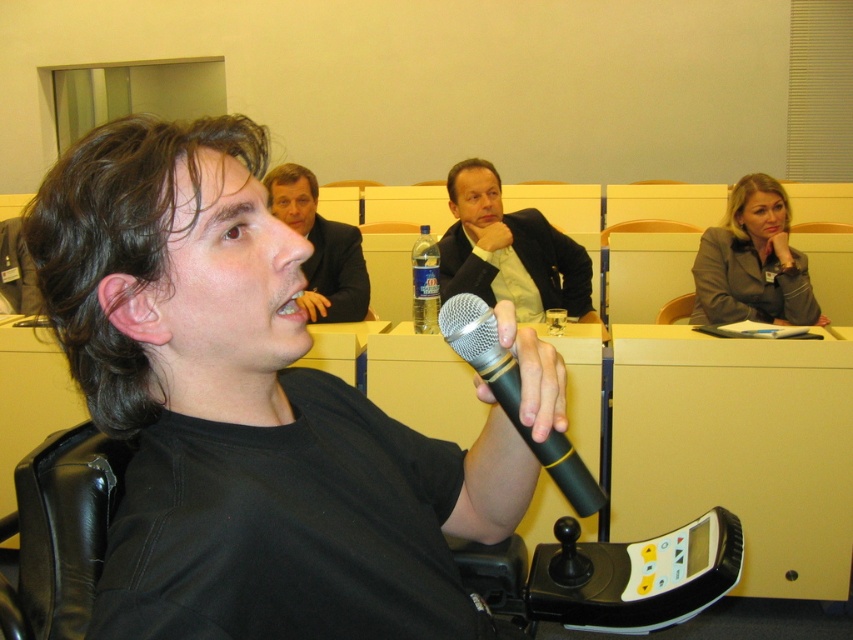
Question: Which of these objects is positioned farthest from the light brown suit at center?

Choices:
 (A) black rubber microphone at center
 (B) light brown suit at upper center
 (C) matte gray blazer at upper right

Answer: (A)

Question: Which is farther from the light brown suit at upper center?

Choices:
 (A) black rubber microphone at center
 (B) light brown suit at center

Answer: (A)

Question: Which point is farther to the camera?

Choices:
 (A) light brown suit at upper center
 (B) light brown suit at center

Answer: (B)

Question: Can you confirm if light brown suit at center is positioned to the left of light brown suit at upper center?

Choices:
 (A) yes
 (B) no

Answer: (B)

Question: Can you confirm if light brown suit at center is positioned to the left of matte gray blazer at upper right?

Choices:
 (A) no
 (B) yes

Answer: (B)

Question: Does light brown suit at center appear under light brown suit at upper center?

Choices:
 (A) no
 (B) yes

Answer: (B)